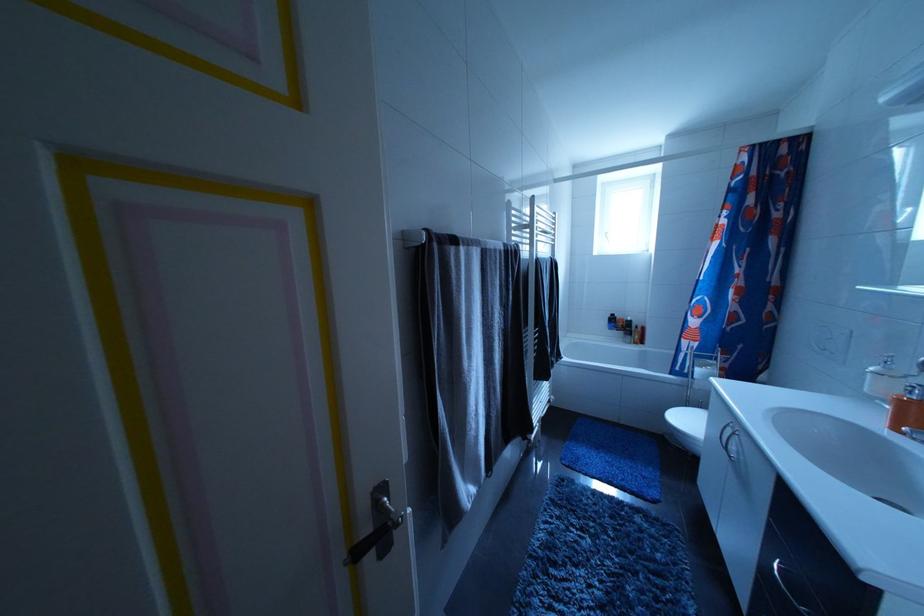
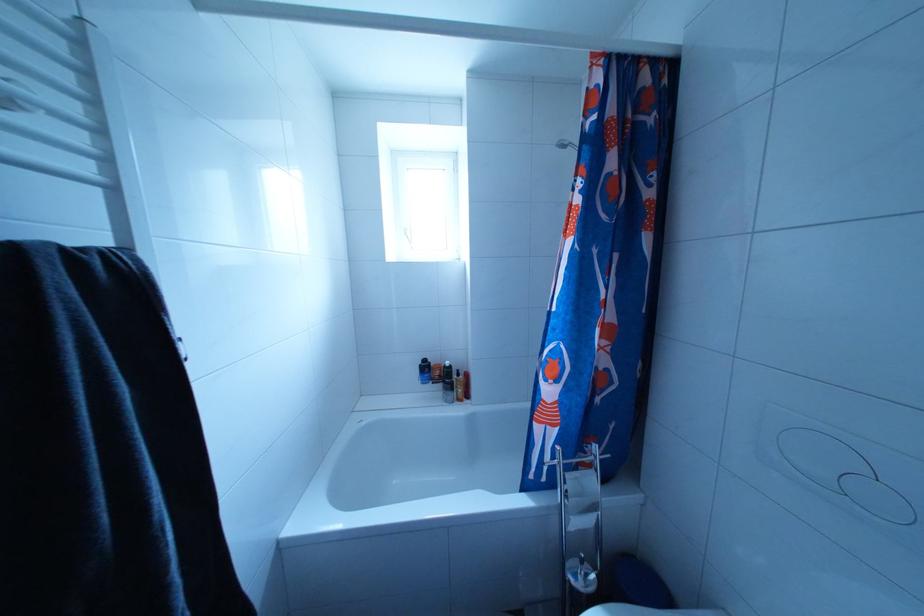
Find the pixel in the second image that matches point 635,339 in the first image.

(455, 395)